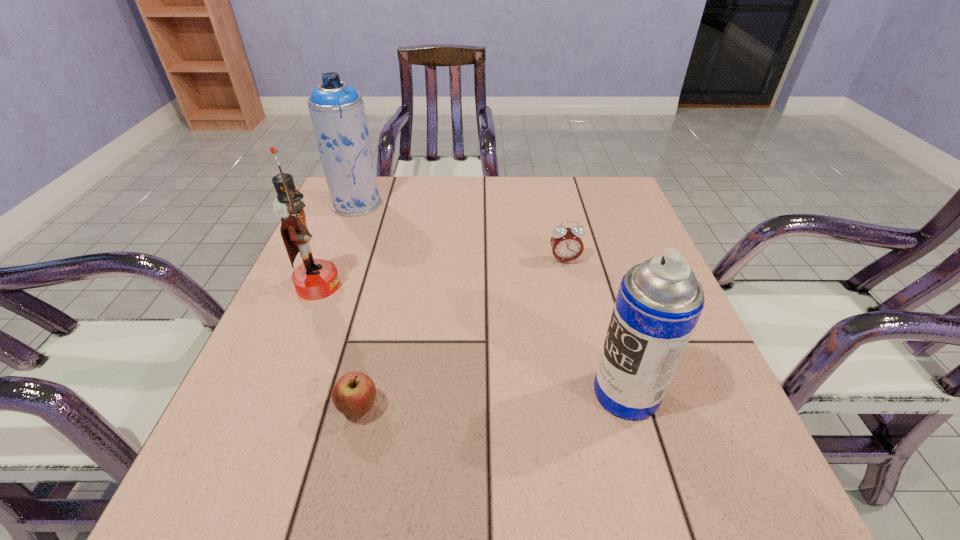
At what (x,y) coordinates should I click in order to perform the action: click on vacant region that satisfies the following two spatial constraints: 1. on the front-facing side of the nutcracker; 2. on the right side of the shortest object. Please return your answer as a coordinate pair (x, y). Looking at the image, I should click on (268, 409).

Identify the location of free space that satisfies the following two spatial constraints: 1. on the label side of the right aerosol can; 2. on the front side of the third object from right to left. The image size is (960, 540). (631, 409).

In order to click on vacant point that satisfies the following two spatial constraints: 1. on the clock face of the alarm clock; 2. on the front-facing side of the third nearest object in this screenshot , I will do `click(570, 286)`.